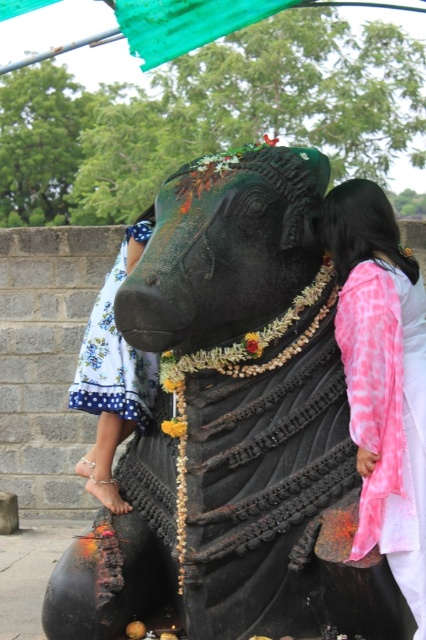
Question: In this image, where is black stone statue at center located relative to blue floral fabric dress at left?

Choices:
 (A) left
 (B) right

Answer: (B)

Question: Based on their relative distances, which object is farther from the black stone statue at center?

Choices:
 (A) pink tie-dye kurta at right
 (B) blue floral fabric dress at left

Answer: (B)

Question: Does black stone statue at center have a lesser width compared to pink tie-dye kurta at right?

Choices:
 (A) no
 (B) yes

Answer: (A)

Question: Among these objects, which one is nearest to the camera?

Choices:
 (A) black stone statue at center
 (B) pink tie-dye kurta at right
 (C) blue floral fabric dress at left

Answer: (A)

Question: Is black stone statue at center further to camera compared to pink tie-dye kurta at right?

Choices:
 (A) yes
 (B) no

Answer: (B)

Question: Among these points, which one is farthest from the camera?

Choices:
 (A) (115, 372)
 (B) (412, 410)
 (C) (247, 605)

Answer: (A)